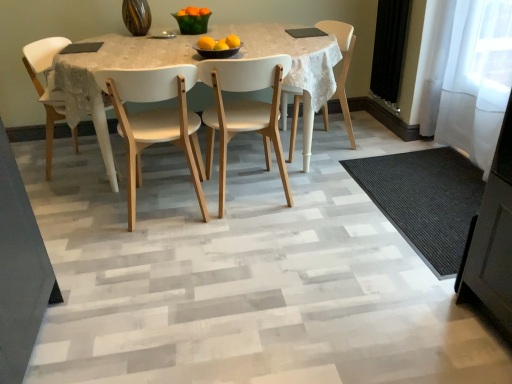
Measure the distance between point (127, 184) and camera.

Point (127, 184) and camera are 8.16 feet apart.

What is the approximate width of transparent glass door at right?

6.51 inches.

What do you see at coordinates (477, 79) in the screenshot?
I see `transparent glass door at right` at bounding box center [477, 79].

Identify the location of white wood chair at center, which appears as the second chair when viewed from the right. (244, 110).

What do you see at coordinates (233, 41) in the screenshot? The width and height of the screenshot is (512, 384). I see `orange matte at center, positioned as the first orange in right-to-left order` at bounding box center [233, 41].

The height and width of the screenshot is (384, 512). I want to click on white matte wood chair at center, the third chair viewed from the right, so click(155, 121).

Is white matte wood chair at center, the 2th chair when ordered from left to right, inside or outside of white wood chair at center, arranged as the fourth chair when viewed from the left?

white matte wood chair at center, the 2th chair when ordered from left to right, exists outside the volume of white wood chair at center, arranged as the fourth chair when viewed from the left.

Does white matte wood chair at center, the third chair viewed from the right, appear on the left side of white wood chair at center, the 1th chair positioned from the right?

Correct, you'll find white matte wood chair at center, the third chair viewed from the right, to the left of white wood chair at center, the 1th chair positioned from the right.

From a real-world perspective, is white matte wood chair at center, the third chair viewed from the right, positioned over white wood chair at center, arranged as the fourth chair when viewed from the left, based on gravity?

Actually, white matte wood chair at center, the third chair viewed from the right, is physically below white wood chair at center, arranged as the fourth chair when viewed from the left, in the real world.

From the picture: Is the position of white matte wood chair at center, the 2th chair when ordered from left to right, more distant than that of white wood chair at center, arranged as the fourth chair when viewed from the left?

No, the depth of white matte wood chair at center, the 2th chair when ordered from left to right, is less than that of white wood chair at center, arranged as the fourth chair when viewed from the left.

From a real-world perspective, is black textured mat at lower right located higher than yellow matte/orange at center, the 3th orange viewed from the right?

No.

From the picture: Considering the sizes of black textured mat at lower right and yellow matte/orange at center, arranged as the 1th orange when viewed from the left, in the image, is black textured mat at lower right bigger or smaller than yellow matte/orange at center, arranged as the 1th orange when viewed from the left,?

In the image, black textured mat at lower right appears to be larger than yellow matte/orange at center, arranged as the 1th orange when viewed from the left.

Can you see black textured mat at lower right touching yellow matte/orange at center, the 3th orange viewed from the right?

No.

Can you tell me how much black textured mat at lower right and yellow matte/orange at center, arranged as the 1th orange when viewed from the left, differ in facing direction?

The facing directions of black textured mat at lower right and yellow matte/orange at center, arranged as the 1th orange when viewed from the left, are 84.2 degrees apart.

Choose the correct answer: Is white wood chair at center, which appears as the second chair when viewed from the right, inside yellow matte/orange at center, arranged as the 1th orange when viewed from the left, or outside it?

white wood chair at center, which appears as the second chair when viewed from the right, is spatially situated outside yellow matte/orange at center, arranged as the 1th orange when viewed from the left.

Is there a large distance between white wood chair at center, which appears as the second chair when viewed from the right, and yellow matte/orange at center, arranged as the 1th orange when viewed from the left?

No, white wood chair at center, which appears as the second chair when viewed from the right, is not far away from yellow matte/orange at center, arranged as the 1th orange when viewed from the left.

From the image's perspective, which object appears higher, white wood chair at center, the third chair when ordered from left to right, or yellow matte/orange at center, arranged as the 1th orange when viewed from the left?

yellow matte/orange at center, arranged as the 1th orange when viewed from the left, from the image's perspective.

Is white wood chair at center, which appears as the second chair when viewed from the right, oriented towards yellow matte/orange at center, the 3th orange viewed from the right?

No, white wood chair at center, which appears as the second chair when viewed from the right, is not turned towards yellow matte/orange at center, the 3th orange viewed from the right.

How distant is white wood chair at left, acting as the 4th chair starting from the right, from orange matte at center, positioned as the first orange in right-to-left order?

A distance of 1.19 meters exists between white wood chair at left, acting as the 4th chair starting from the right, and orange matte at center, positioned as the first orange in right-to-left order.

Who is taller, white wood chair at left, the first chair in the left-to-right sequence, or orange matte at center, positioned as the first orange in right-to-left order?

white wood chair at left, the first chair in the left-to-right sequence.

Which orange is the 3rd one when counting from the right side of the white wood chair at left, the first chair in the left-to-right sequence? Please provide its 2D coordinates.

[(233, 41)]

Does point (28, 59) appear closer or farther from the camera than point (227, 41)?

Point (28, 59).

I want to click on kitchen & dining room table located above the white matte wood chair at center, the 2th chair when ordered from left to right (from a real-world perspective), so click(109, 68).

Based on their sizes in the image, would you say white glossy table at center is bigger or smaller than white matte wood chair at center, the third chair viewed from the right?

white glossy table at center is bigger than white matte wood chair at center, the third chair viewed from the right.

Consider the image. Is white matte wood chair at center, the third chair viewed from the right, surrounded by white glossy table at center?

Yes.

In the scene shown: How distant is white glossy table at center from white matte wood chair at center, the 2th chair when ordered from left to right?

They are 26.83 centimeters apart.

Is orange matte at center, positioned as the third orange in left-to-right order, completely or partially outside of white wood chair at center, arranged as the fourth chair when viewed from the left?

Indeed, orange matte at center, positioned as the third orange in left-to-right order, is completely outside white wood chair at center, arranged as the fourth chair when viewed from the left.

Which point is more distant from viewer, (228, 44) or (293, 121)?

The point (293, 121) is behind.

Is orange matte at center, positioned as the first orange in right-to-left order, looking in the opposite direction of white wood chair at center, the 1th chair positioned from the right?

No, orange matte at center, positioned as the first orange in right-to-left order, is not facing the opposite direction of white wood chair at center, the 1th chair positioned from the right.

Would you say orange matte at center, positioned as the first orange in right-to-left order, is to the left or to the right of white wood chair at center, arranged as the fourth chair when viewed from the left, in the picture?

orange matte at center, positioned as the first orange in right-to-left order, is positioned on white wood chair at center, arranged as the fourth chair when viewed from the left,'s left side.

Which object is thinner, white glossy table at center or white wood chair at left, acting as the 4th chair starting from the right?

white wood chair at left, acting as the 4th chair starting from the right.

Is white glossy table at center in front of or behind white wood chair at left, acting as the 4th chair starting from the right, in the image?

white glossy table at center is positioned closer to the viewer than white wood chair at left, acting as the 4th chair starting from the right.

The image size is (512, 384). Find the location of `chair that is the 1st object above the white matte wood chair at center, the 2th chair when ordered from left to right (from a real-world perspective)`. chair that is the 1st object above the white matte wood chair at center, the 2th chair when ordered from left to right (from a real-world perspective) is located at coordinates (343, 65).

From the black textured mat at lower right, count 1st oranges backward and point to it. Please provide its 2D coordinates.

[(206, 43)]

Which object lies further to the anchor point transparent glass door at right, matte black bowl at center or white wood chair at center, the third chair when ordered from left to right?

Based on the image, matte black bowl at center appears to be further to transparent glass door at right.

Considering their positions, is black textured mat at lower right positioned further to orange matte at center, positioned as the first orange in right-to-left order, than white wood chair at center, arranged as the fourth chair when viewed from the left?

black textured mat at lower right is further to orange matte at center, positioned as the first orange in right-to-left order.

When comparing their distances from yellow matte/orange at center, the 3th orange viewed from the right, does white glossy table at center or white wood chair at center, which appears as the second chair when viewed from the right, seem further?

white wood chair at center, which appears as the second chair when viewed from the right, lies further to yellow matte/orange at center, the 3th orange viewed from the right, than the other object.

Based on the photo, based on their spatial positions, is orange matte at center, positioned as the first orange in right-to-left order, or white wood chair at left, acting as the 4th chair starting from the right, further from white wood chair at center, which appears as the second chair when viewed from the right?

white wood chair at left, acting as the 4th chair starting from the right, lies further to white wood chair at center, which appears as the second chair when viewed from the right, than the other object.

Estimate the real-world distances between objects in this image. Which object is further from white wood chair at left, acting as the 4th chair starting from the right, orange matte at center, positioned as the first orange in right-to-left order, or yellow matte/orange at center, arranged as the 1th orange when viewed from the left?

orange matte at center, positioned as the first orange in right-to-left order.

Considering their positions, is yellow matte/orange at center, placed as the 2th orange when sorted from left to right, positioned further to white wood chair at center, the 1th chair positioned from the right, than white glossy table at center?

Among the two, white glossy table at center is located further to white wood chair at center, the 1th chair positioned from the right.

Based on their spatial positions, is transparent glass door at right or yellow matte/orange at center, placed as the 2th orange when sorted from left to right, closer to white matte wood chair at center, the 2th chair when ordered from left to right?

The object closer to white matte wood chair at center, the 2th chair when ordered from left to right, is yellow matte/orange at center, placed as the 2th orange when sorted from left to right.

Considering their positions, is white wood chair at center, the third chair when ordered from left to right, positioned further to black textured mat at lower right than matte black bowl at center?

Based on the image, matte black bowl at center appears to be further to black textured mat at lower right.

Where is `chair between white wood chair at left, the first chair in the left-to-right sequence, and white glossy table at center from left to right`? This screenshot has height=384, width=512. chair between white wood chair at left, the first chair in the left-to-right sequence, and white glossy table at center from left to right is located at coordinates (155, 121).

Locate an element on the screen. The width and height of the screenshot is (512, 384). kitchen & dining room table that lies between yellow matte/orange at center, which is the second orange from right to left, and white matte wood chair at center, the 2th chair when ordered from left to right, from top to bottom is located at coordinates (109, 68).

Locate an element on the screen. Image resolution: width=512 pixels, height=384 pixels. bowl between white wood chair at left, the first chair in the left-to-right sequence, and white wood chair at center, the 1th chair positioned from the right, in the horizontal direction is located at coordinates (216, 52).

You are a GUI agent. You are given a task and a screenshot of the screen. Output one action in this format:
    pyautogui.click(x=<x>, y=<y>)
    Task: Click on the chair situated between white glossy table at center and white wood chair at center, arranged as the fourth chair when viewed from the left, from left to right
    This screenshot has width=512, height=384.
    Given the screenshot: What is the action you would take?
    pyautogui.click(x=244, y=110)